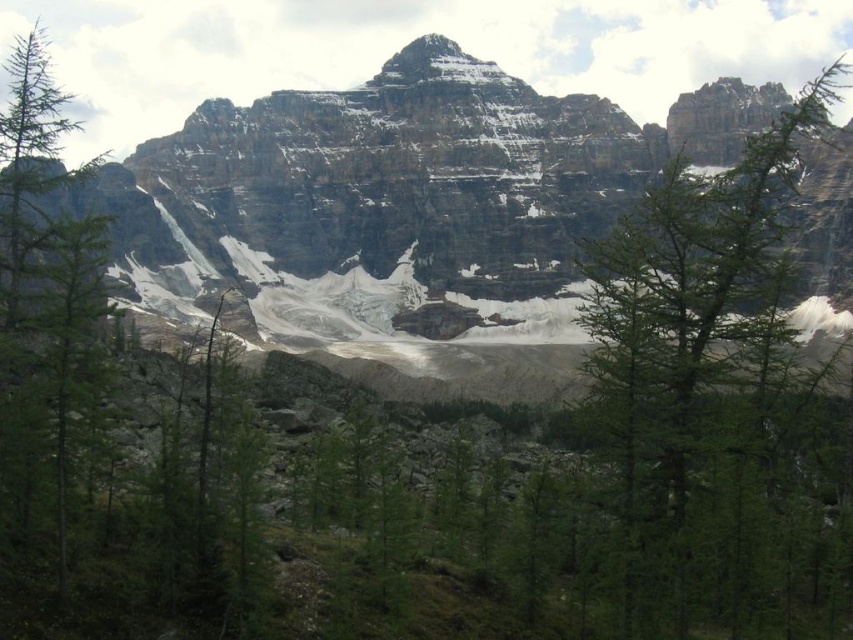
Question: Is rocky mountain at center to the left of green needle-like tree at upper right from the viewer's perspective?

Choices:
 (A) no
 (B) yes

Answer: (B)

Question: Does green needle-like tree at upper right have a smaller size compared to green matte tree at left?

Choices:
 (A) no
 (B) yes

Answer: (A)

Question: Is rocky mountain at center wider than green needle-like tree at upper right?

Choices:
 (A) yes
 (B) no

Answer: (A)

Question: Among these points, which one is nearest to the camera?

Choices:
 (A) (440, 104)
 (B) (15, 116)

Answer: (B)

Question: Which point is farther to the camera?

Choices:
 (A) green matte tree at left
 (B) green needle-like tree at upper right
 (C) rocky mountain at center

Answer: (C)

Question: Which object is the farthest from the green matte tree at left?

Choices:
 (A) rocky mountain at center
 (B) green needle-like tree at upper right

Answer: (B)